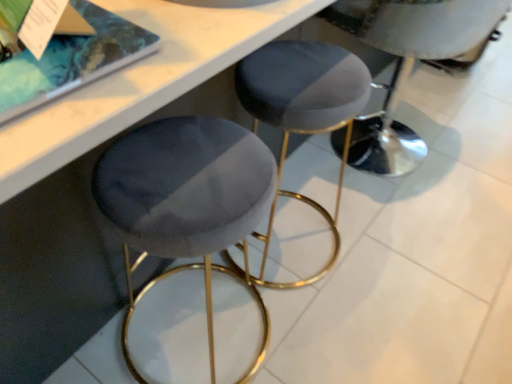
Locate an element on the screen. The width and height of the screenshot is (512, 384). vacant space in front of velvet grey stool at center is located at coordinates (334, 336).